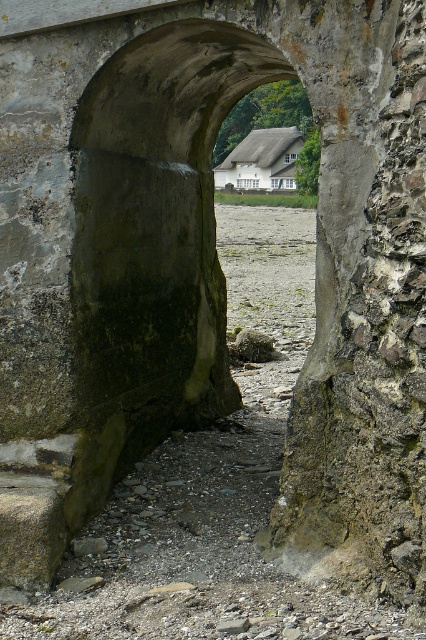
Is the position of dark gray stone archway at center more distant than that of white wooden house at center?

No, dark gray stone archway at center is in front of white wooden house at center.

In the scene shown: Who is higher up, dark gray stone archway at center or white wooden house at center?

white wooden house at center is higher up.

Which is in front, point (180, 340) or point (256, 144)?

Point (180, 340) is in front.

This screenshot has height=640, width=426. I want to click on dark gray stone archway at center, so click(157, 221).